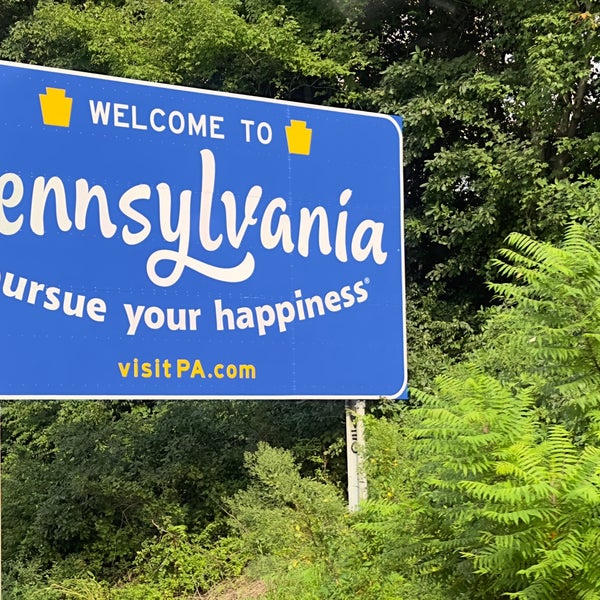
Identify the location of green ferns. The image size is (600, 600). (543, 304), (469, 441), (525, 258), (575, 486), (461, 538).